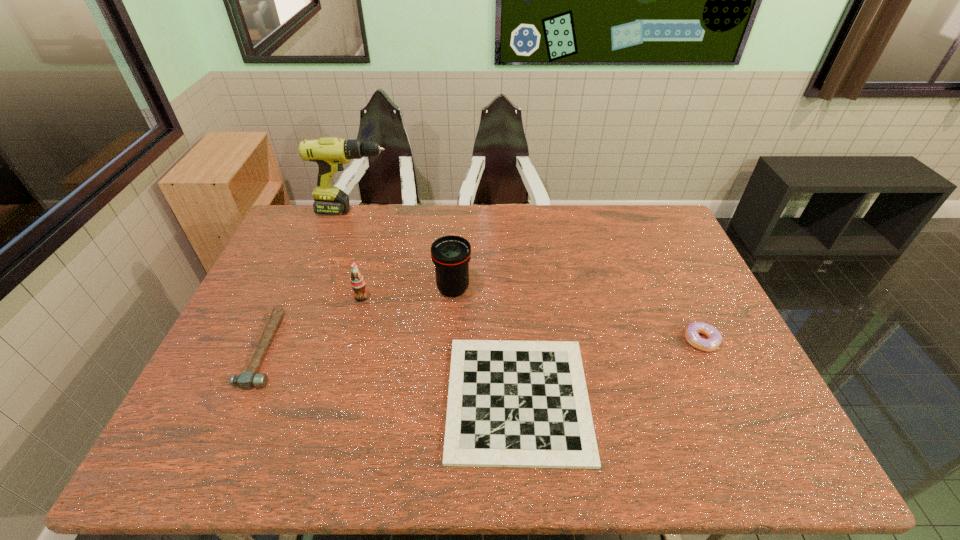
This screenshot has width=960, height=540. Identify the location of vacant space situated 0.220m on the left of the soda. (281, 298).

Locate an element on the screen. The height and width of the screenshot is (540, 960). vacant area situated on the back of the rightmost object is located at coordinates (685, 307).

At what (x,y) coordinates should I click in order to perform the action: click on free location located on the striking face of the fifth tallest object. Please return your answer as a coordinate pair (x, y). The height and width of the screenshot is (540, 960). Looking at the image, I should click on (432, 349).

I want to click on free space located 0.050m on the left of the checkerboard, so click(426, 399).

Identify the location of object present at the far edge. (330, 153).

The height and width of the screenshot is (540, 960). What are the coordinates of `object located in the near edge section of the desktop` in the screenshot? It's located at (525, 404).

Image resolution: width=960 pixels, height=540 pixels. In order to click on drill at the left edge in this screenshot , I will do `click(330, 153)`.

Identify the location of hammer positioned at the left edge. (246, 380).

The width and height of the screenshot is (960, 540). Find the location of `object located at the right edge`. object located at the right edge is located at coordinates (714, 336).

You are a GUI agent. You are given a task and a screenshot of the screen. Output one action in this format:
    pyautogui.click(x=<x>, y=<y>)
    Task: Click on the object present at the far left corner
    
    Given the screenshot: What is the action you would take?
    pyautogui.click(x=330, y=153)